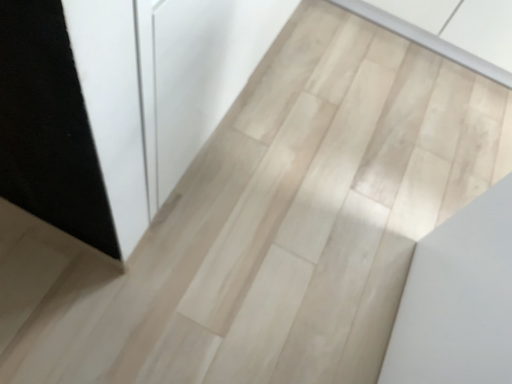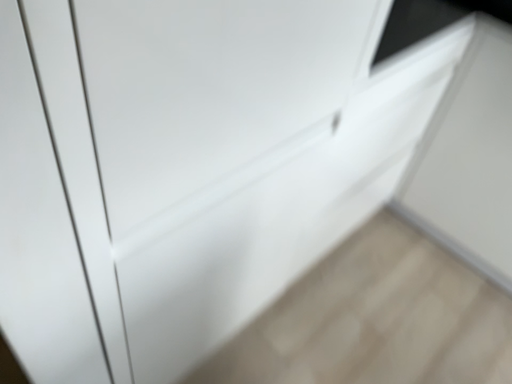
Question: Which way did the camera rotate in the video?

Choices:
 (A) rotated downward
 (B) rotated upward

Answer: (B)